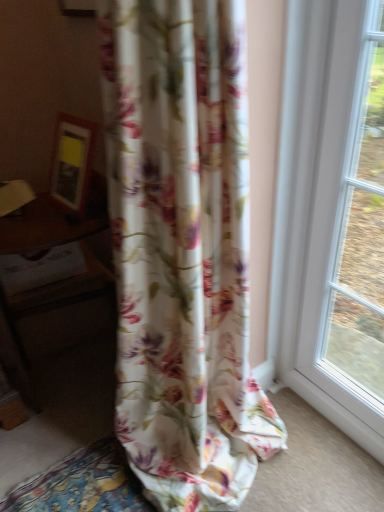
Locate an element on the screen. This screenshot has width=384, height=512. free point below wooden table at left (from a real-world perspective) is located at coordinates (75, 372).